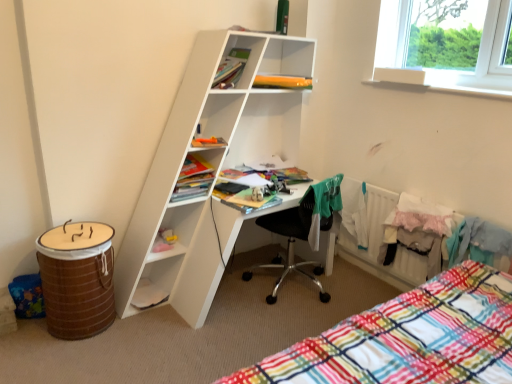
Locate an element on the screen. This screenshot has width=512, height=384. vacant area that is in front of brown woven barrel at lower left is located at coordinates (66, 359).